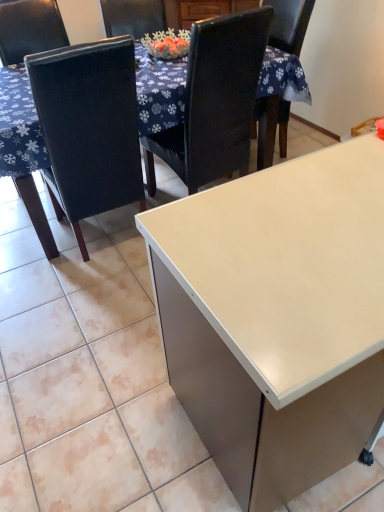
I want to click on vacant space situated on the left part of white glossy desk at center, so click(95, 390).